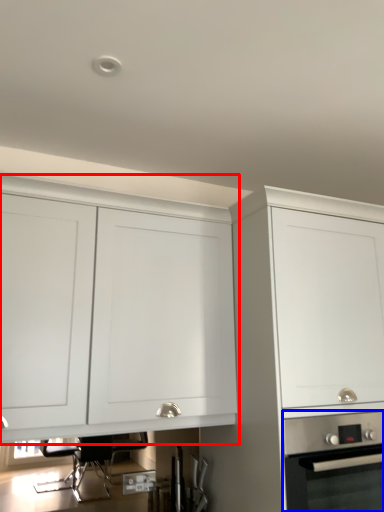
Question: Among these objects, which one is nearest to the camera, cabinetry (highlighted by a red box) or home appliance (highlighted by a blue box)?

Choices:
 (A) cabinetry
 (B) home appliance

Answer: (A)